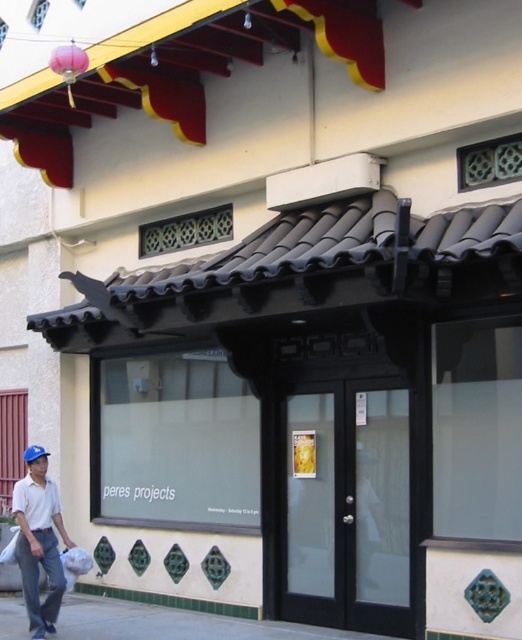
Does smooth concrete pavement at lower center have a lesser height compared to white matte shirt at lower left?

Correct, smooth concrete pavement at lower center is not as tall as white matte shirt at lower left.

Does smooth concrete pavement at lower center appear on the left side of white matte shirt at lower left?

Incorrect, smooth concrete pavement at lower center is not on the left side of white matte shirt at lower left.

The width and height of the screenshot is (522, 640). I want to click on smooth concrete pavement at lower center, so click(175, 624).